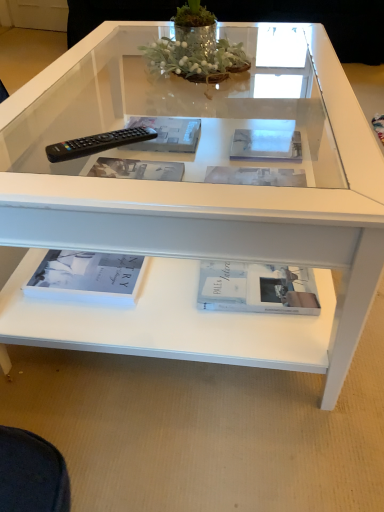
Describe the element at coordinates (257, 288) in the screenshot. I see `white matte book at lower center, which ranks as the second book in left-to-right order` at that location.

In order to face matte gray book at lower left, which is counted as the second book, starting from the right, should I rotate leftwards or rightwards?

Rotate your view left by about 12.596°.

Identify the location of white matte book at lower center, which is counted as the first book, starting from the right. The image size is (384, 512). (257, 288).

Which object is positioned more to the right, white glossy magazine at center, arranged as the second magazine when viewed from the left, or black plastic remote at left?

white glossy magazine at center, arranged as the second magazine when viewed from the left, is more to the right.

Is white glossy magazine at center, which is counted as the first magazine, starting from the right, aimed at black plastic remote at left?

No, white glossy magazine at center, which is counted as the first magazine, starting from the right, is not oriented towards black plastic remote at left.

Which of these two, white glossy magazine at center, arranged as the second magazine when viewed from the left, or black plastic remote at left, is smaller?

Smaller between the two is black plastic remote at left.

How different are the orientations of white glossy magazine at center, arranged as the second magazine when viewed from the left, and black plastic remote at left in degrees?

40.8 degrees.

From the image's perspective, which object appears higher, black plastic remote at left or clear plastic magazine at center, the second magazine from the right?

clear plastic magazine at center, the second magazine from the right.

Considering the positions of objects black plastic remote at left and clear plastic magazine at center, the second magazine from the right, in the image provided, who is in front, black plastic remote at left or clear plastic magazine at center, the second magazine from the right,?

black plastic remote at left is closer to the camera.

Which object is positioned more to the left, black plastic remote at left or clear plastic magazine at center, positioned as the 1th magazine in left-to-right order?

Positioned to the left is black plastic remote at left.

Is black plastic remote at left bigger than clear plastic magazine at center, the second magazine from the right?

No, black plastic remote at left is not bigger than clear plastic magazine at center, the second magazine from the right.

From a real-world perspective, starting from the clear plastic magazine at center, positioned as the 1th magazine in left-to-right order, which book is the 2nd one below it? Please provide its 2D coordinates.

[(257, 288)]

Is clear plastic magazine at center, positioned as the 1th magazine in left-to-right order, positioned far away from white matte book at lower center, which is counted as the first book, starting from the right?

No, clear plastic magazine at center, positioned as the 1th magazine in left-to-right order, is in close proximity to white matte book at lower center, which is counted as the first book, starting from the right.

In the scene shown: Does clear plastic magazine at center, the second magazine from the right, have a greater height compared to white matte book at lower center, which is counted as the first book, starting from the right?

Indeed, clear plastic magazine at center, the second magazine from the right, has a greater height compared to white matte book at lower center, which is counted as the first book, starting from the right.

From the image's perspective, is clear plastic magazine at center, positioned as the 1th magazine in left-to-right order, located above white matte book at lower center, which is counted as the first book, starting from the right?

Indeed, from the image's perspective, clear plastic magazine at center, positioned as the 1th magazine in left-to-right order, is shown above white matte book at lower center, which is counted as the first book, starting from the right.

Looking at this image, is black plastic remote at left taller than white matte book at lower center, which is counted as the first book, starting from the right?

In fact, black plastic remote at left may be shorter than white matte book at lower center, which is counted as the first book, starting from the right.

Is black plastic remote at left bigger than white matte book at lower center, which ranks as the second book in left-to-right order?

No.

From the picture: From the image's perspective, is black plastic remote at left below white matte book at lower center, which ranks as the second book in left-to-right order?

No.

Is white matte book at lower center, which ranks as the second book in left-to-right order, at the back of black plastic remote at left?

No, black plastic remote at left is not facing the opposite direction of white matte book at lower center, which ranks as the second book in left-to-right order.

Is black plastic remote at left facing towards matte gray book at lower left, which is counted as the second book, starting from the right?

No, black plastic remote at left does not turn towards matte gray book at lower left, which is counted as the second book, starting from the right.

Is black plastic remote at left not close to matte gray book at lower left, which is counted as the second book, starting from the right?

No, black plastic remote at left is not far from matte gray book at lower left, which is counted as the second book, starting from the right.

Consider the image. From the image's perspective, is black plastic remote at left located above or below matte gray book at lower left, marked as the first book in a left-to-right arrangement?

From the image's perspective, black plastic remote at left appears above matte gray book at lower left, marked as the first book in a left-to-right arrangement.

Is white matte book at lower center, which is counted as the first book, starting from the right, bigger or smaller than clear plastic magazine at center, positioned as the 1th magazine in left-to-right order?

Clearly, white matte book at lower center, which is counted as the first book, starting from the right, is smaller in size than clear plastic magazine at center, positioned as the 1th magazine in left-to-right order.

Could you tell me if white matte book at lower center, which is counted as the first book, starting from the right, is turned towards clear plastic magazine at center, the second magazine from the right?

No.

Is point (231, 272) behind point (128, 139)?

That is True.

Where is `remote control above the white matte book at lower center, which ranks as the second book in left-to-right order (from the image's perspective)`? remote control above the white matte book at lower center, which ranks as the second book in left-to-right order (from the image's perspective) is located at coordinates (98, 143).

Where is `remote control located below the white glossy magazine at center, which is counted as the first magazine, starting from the right (from the image's perspective)`? This screenshot has height=512, width=384. remote control located below the white glossy magazine at center, which is counted as the first magazine, starting from the right (from the image's perspective) is located at coordinates (98, 143).

From the image's perspective, count 2nd magazines upward from the black plastic remote at left and point to it. Please provide its 2D coordinates.

[(167, 134)]

Looking at this image, based on their spatial positions, is clear plastic magazine at center, positioned as the 1th magazine in left-to-right order, or white glossy magazine at center, arranged as the second magazine when viewed from the left, closer to white matte book at lower center, which ranks as the second book in left-to-right order?

Based on the image, white glossy magazine at center, arranged as the second magazine when viewed from the left, appears to be nearer to white matte book at lower center, which ranks as the second book in left-to-right order.

When comparing their distances from white matte book at lower center, which is counted as the first book, starting from the right, does matte gray book at lower left, which is counted as the second book, starting from the right, or white glossy magazine at center, which is counted as the first magazine, starting from the right, seem further?

Based on the image, white glossy magazine at center, which is counted as the first magazine, starting from the right, appears to be further to white matte book at lower center, which is counted as the first book, starting from the right.

In the scene shown: Looking at the image, which one is located closer to white matte book at lower center, which is counted as the first book, starting from the right, matte gray book at lower left, marked as the first book in a left-to-right arrangement, or black plastic remote at left?

Among the two, matte gray book at lower left, marked as the first book in a left-to-right arrangement, is located nearer to white matte book at lower center, which is counted as the first book, starting from the right.

When comparing their distances from white glossy magazine at center, which is counted as the first magazine, starting from the right, does matte gray book at lower left, which is counted as the second book, starting from the right, or black plastic remote at left seem further?

Based on the image, matte gray book at lower left, which is counted as the second book, starting from the right, appears to be further to white glossy magazine at center, which is counted as the first magazine, starting from the right.

Estimate the real-world distances between objects in this image. Which object is closer to white glossy magazine at center, which is counted as the first magazine, starting from the right, black plastic remote at left or white matte book at lower center, which is counted as the first book, starting from the right?

The object closer to white glossy magazine at center, which is counted as the first magazine, starting from the right, is black plastic remote at left.

Which object lies further to the anchor point clear plastic magazine at center, positioned as the 1th magazine in left-to-right order, black plastic remote at left or white glossy magazine at center, which is counted as the first magazine, starting from the right?

Based on the image, black plastic remote at left appears to be further to clear plastic magazine at center, positioned as the 1th magazine in left-to-right order.

From the image, which object appears to be nearer to clear plastic magazine at center, positioned as the 1th magazine in left-to-right order, white matte book at lower center, which ranks as the second book in left-to-right order, or matte gray book at lower left, marked as the first book in a left-to-right arrangement?

matte gray book at lower left, marked as the first book in a left-to-right arrangement, is closer to clear plastic magazine at center, positioned as the 1th magazine in left-to-right order.

Estimate the real-world distances between objects in this image. Which object is closer to black plastic remote at left, white matte book at lower center, which is counted as the first book, starting from the right, or clear plastic magazine at center, the second magazine from the right?

Among the two, clear plastic magazine at center, the second magazine from the right, is located nearer to black plastic remote at left.

Find the location of a particular element. remote control between matte gray book at lower left, marked as the first book in a left-to-right arrangement, and white matte book at lower center, which ranks as the second book in left-to-right order is located at coordinates (98, 143).

Identify the location of magazine between matte gray book at lower left, marked as the first book in a left-to-right arrangement, and clear plastic magazine at center, positioned as the 1th magazine in left-to-right order, from front to back. (266, 145).

Locate an element on the screen. Image resolution: width=384 pixels, height=512 pixels. magazine between white matte book at lower center, which is counted as the first book, starting from the right, and clear plastic magazine at center, the second magazine from the right, from front to back is located at coordinates (266, 145).

This screenshot has height=512, width=384. What are the coordinates of `book between white matte book at lower center, which is counted as the first book, starting from the right, and clear plastic magazine at center, the second magazine from the right, along the z-axis` in the screenshot? It's located at (88, 277).